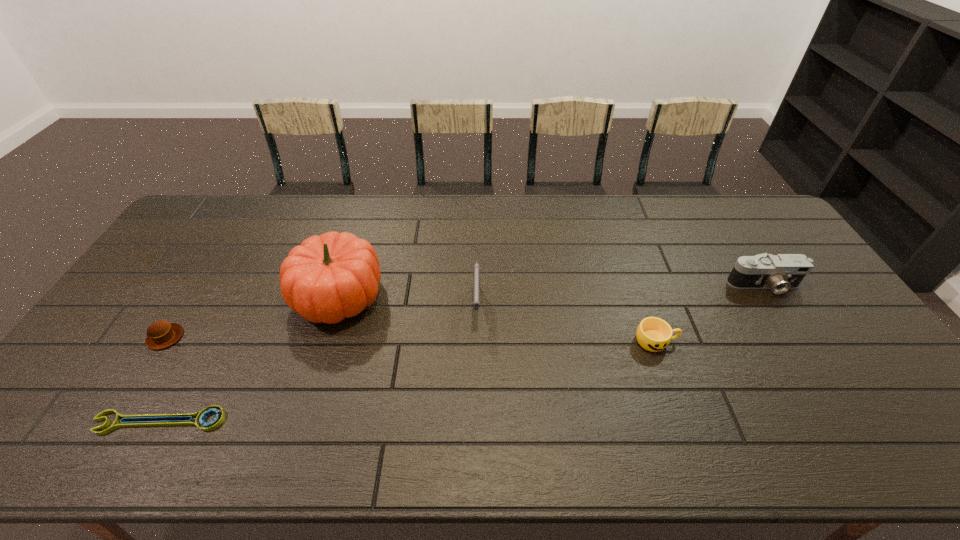
This screenshot has height=540, width=960. What are the coordinates of `the fourth object from right to left` in the screenshot? It's located at (328, 278).

Locate an element on the screen. This screenshot has height=540, width=960. the tallest object is located at coordinates (328, 278).

The image size is (960, 540). I want to click on the fourth object from left to right, so click(x=476, y=277).

Find the location of a particular element. The width and height of the screenshot is (960, 540). camera is located at coordinates (781, 272).

Locate an element on the screen. The image size is (960, 540). the fifth object from left to right is located at coordinates (653, 334).

You are a GUI agent. You are given a task and a screenshot of the screen. Output one action in this format:
    pyautogui.click(x=<x>, y=<y>)
    Task: Click on the muffin
    The width and height of the screenshot is (960, 540).
    Given the screenshot: What is the action you would take?
    pyautogui.click(x=161, y=334)

Find the location of `wrench`. wrench is located at coordinates (200, 416).

Identify the location of the nearest object. (200, 416).

Identify the location of free location located on the left of the fourth object from right to left. (266, 296).

I want to click on vacant space located at the barrel of the fourth object from left to right, so click(x=476, y=404).